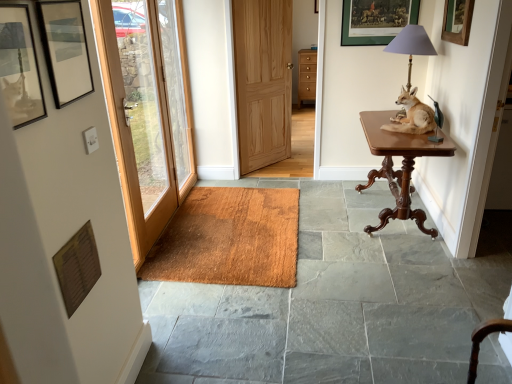
Question: Is wooden door at left, which is counted as the 2th door, starting from the right, further to camera compared to natural wood door at center, the second door when ordered from left to right?

Choices:
 (A) no
 (B) yes

Answer: (A)

Question: Considering the relative sizes of wooden door at left, which is the first door in front-to-back order, and natural wood door at center, the second door when ordered from left to right, in the image provided, is wooden door at left, which is the first door in front-to-back order, wider than natural wood door at center, the second door when ordered from left to right,?

Choices:
 (A) yes
 (B) no

Answer: (A)

Question: Considering the relative positions of wooden door at left, which is the first door in front-to-back order, and natural wood door at center, positioned as the second door in front-to-back order, in the image provided, is wooden door at left, which is the first door in front-to-back order, to the right of natural wood door at center, positioned as the second door in front-to-back order, from the viewer's perspective?

Choices:
 (A) yes
 (B) no

Answer: (B)

Question: From a real-world perspective, is wooden door at left, positioned as the first door in left-to-right order, physically above natural wood door at center, positioned as the second door in front-to-back order?

Choices:
 (A) no
 (B) yes

Answer: (B)

Question: Does wooden door at left, marked as the 2th door in a back-to-front arrangement, have a lesser width compared to natural wood door at center, placed as the 1th door when sorted from right to left?

Choices:
 (A) no
 (B) yes

Answer: (A)

Question: Could you tell me if wooden door at left, marked as the 2th door in a back-to-front arrangement, is facing natural wood door at center, placed as the 1th door when sorted from right to left?

Choices:
 (A) yes
 (B) no

Answer: (B)

Question: Is brown textured mat at center looking in the opposite direction of wooden picture frame at upper right, which is counted as the first picture frame, starting from the right?

Choices:
 (A) no
 (B) yes

Answer: (A)

Question: From a real-world perspective, does brown textured mat at center sit lower than wooden picture frame at upper right, the 2th picture frame viewed from the top?

Choices:
 (A) yes
 (B) no

Answer: (A)

Question: Does brown textured mat at center have a lesser width compared to wooden picture frame at upper right, the 2th picture frame viewed from the top?

Choices:
 (A) no
 (B) yes

Answer: (A)

Question: From the image's perspective, is brown textured mat at center above wooden picture frame at upper right, the third picture frame viewed from the front?

Choices:
 (A) yes
 (B) no

Answer: (B)

Question: Is brown textured mat at center to the left of wooden picture frame at upper right, the 2th picture frame viewed from the top, from the viewer's perspective?

Choices:
 (A) yes
 (B) no

Answer: (A)

Question: From the image's perspective, is brown textured mat at center located beneath wooden picture frame at upper right, placed as the fourth picture frame when sorted from left to right?

Choices:
 (A) yes
 (B) no

Answer: (A)

Question: From a real-world perspective, is natural wood door at center, positioned as the second door in front-to-back order, under wooden picture frame at upper center, which is the fourth picture frame in front-to-back order?

Choices:
 (A) no
 (B) yes

Answer: (B)